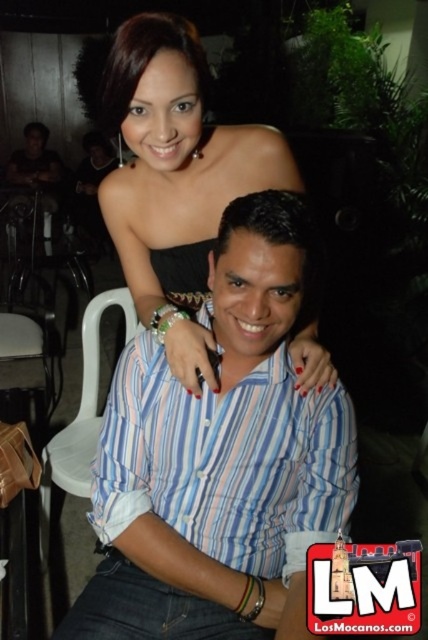
Which is in front, point (270, 216) or point (12, 307)?

Positioned in front is point (270, 216).

Does matte black dress at upper center have a larger size compared to white plastic chair at lower left?

Incorrect, matte black dress at upper center is not larger than white plastic chair at lower left.

Where is `matte black dress at upper center`? matte black dress at upper center is located at coordinates (220, 456).

You are a GUI agent. You are given a task and a screenshot of the screen. Output one action in this format:
    pyautogui.click(x=<x>, y=<y>)
    Task: Click on the matte black dress at upper center
    The height and width of the screenshot is (640, 428).
    Given the screenshot: What is the action you would take?
    pyautogui.click(x=220, y=456)

Can you confirm if matte black dress at upper center is taller than striped cotton shirt at center?

Yes, matte black dress at upper center is taller than striped cotton shirt at center.

Find the location of `matte black dress at upper center`. matte black dress at upper center is located at coordinates (220, 456).

What do you see at coordinates (220, 456) in the screenshot?
I see `matte black dress at upper center` at bounding box center [220, 456].

Where is `matte black dress at upper center`? matte black dress at upper center is located at coordinates (220, 456).

Is striped cotton shirt at center bigger than black woven dress at center?

Indeed, striped cotton shirt at center has a larger size compared to black woven dress at center.

Is striped cotton shirt at center thinner than black woven dress at center?

No.

Between point (143, 385) and point (199, 289), which one is positioned behind?

The point (199, 289) is more distant.

This screenshot has width=428, height=640. Identify the location of striped cotton shirt at center. (225, 461).